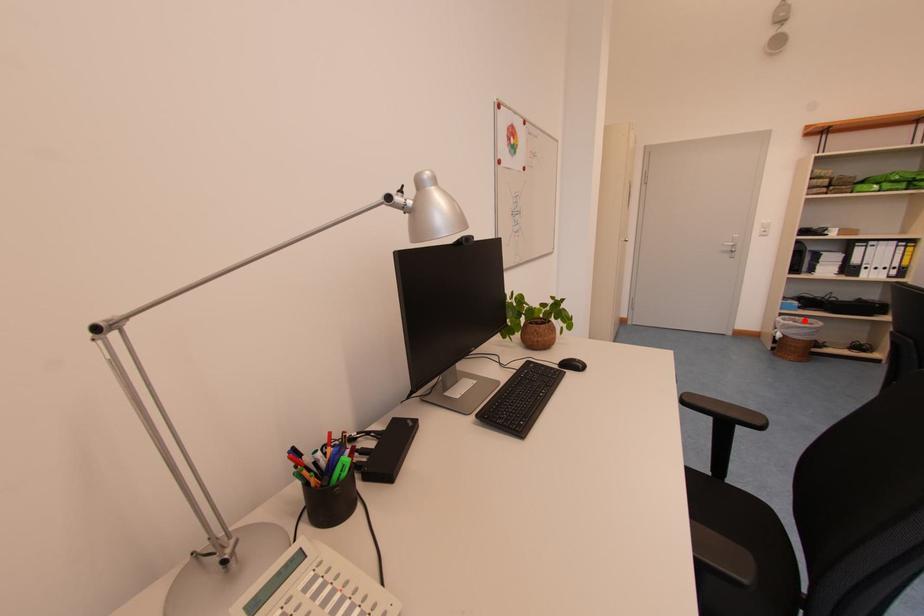
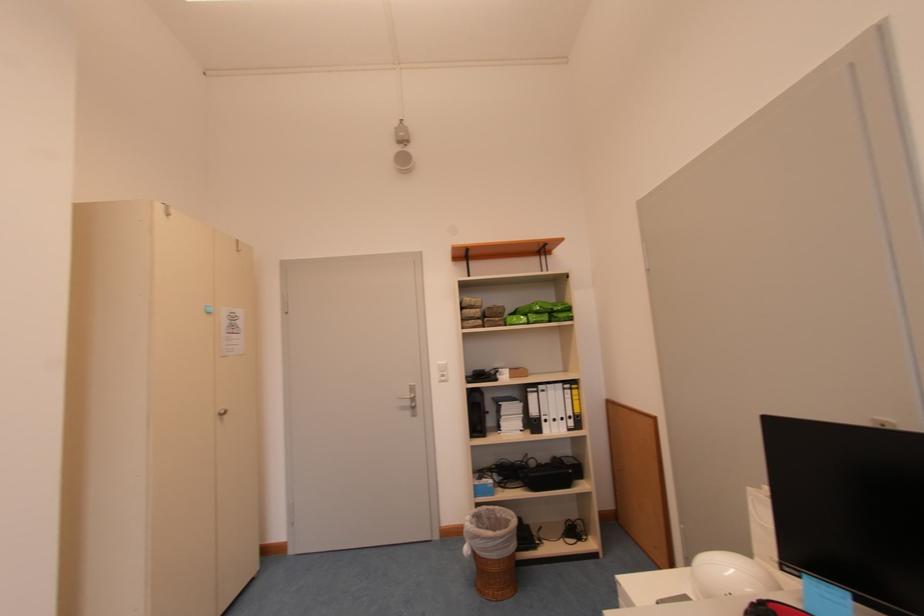
The point at the highlighted location is marked in the first image. Where is the corresponding point in the second image?

(504, 509)